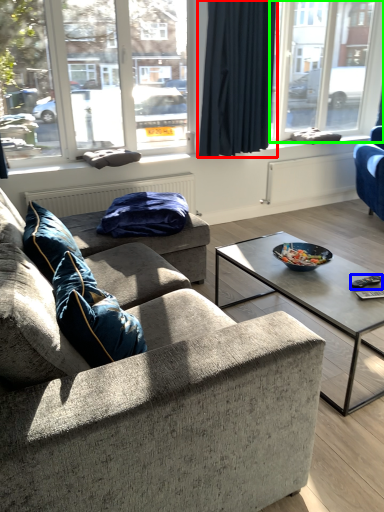
Question: Estimate the real-world distances between objects in this image. Which object is farther from curtain (highlighted by a red box), remote (highlighted by a blue box) or window (highlighted by a green box)?

Choices:
 (A) remote
 (B) window

Answer: (B)